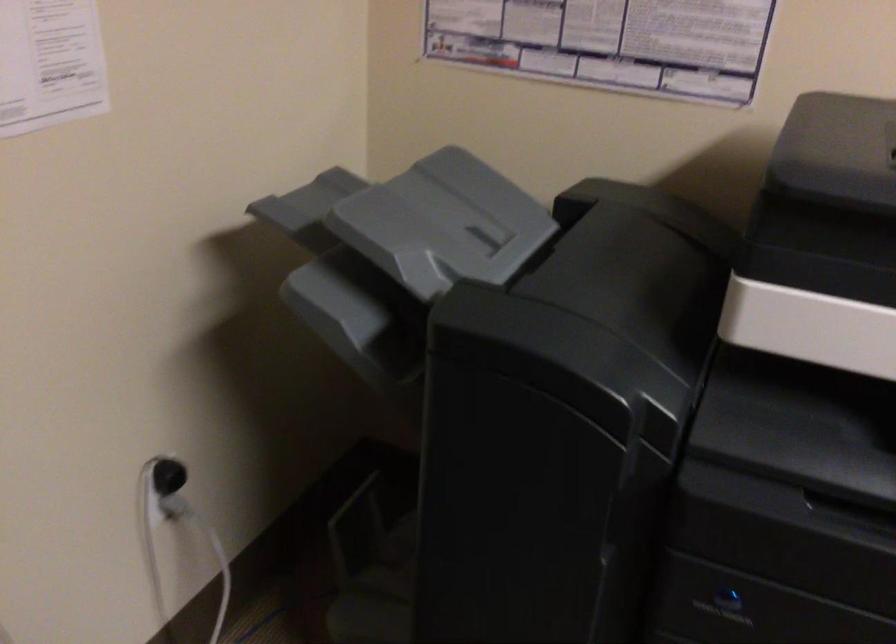
The width and height of the screenshot is (896, 644). What do you see at coordinates (400, 252) in the screenshot?
I see `a grey sorter tray` at bounding box center [400, 252].